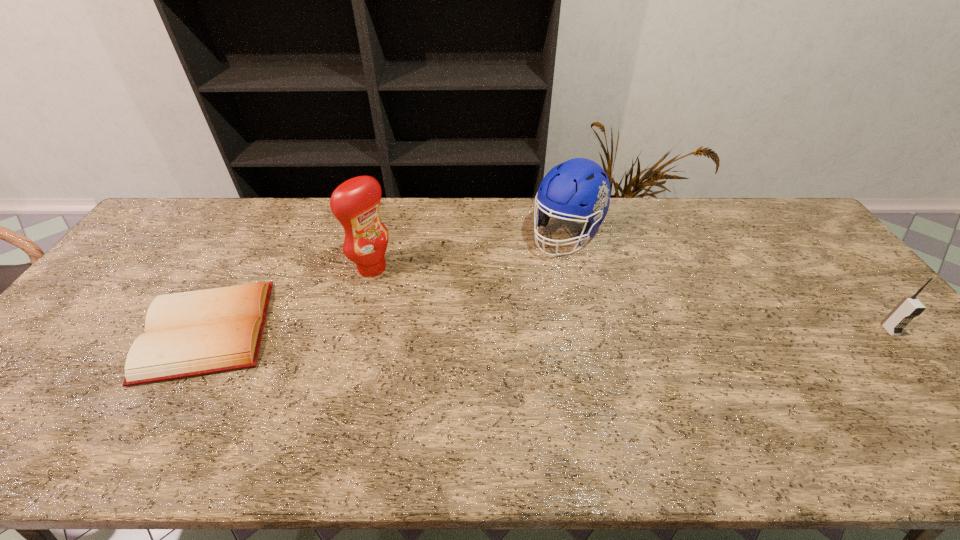
You are a GUI agent. You are given a task and a screenshot of the screen. Output one action in this format:
    pyautogui.click(x=<x>, y=<y>)
    Task: Click on the vacant spot on the desktop that is between the leftmost object and the cellular telephone and is positioned on the face guard of the third object from left to right
    This screenshot has width=960, height=540.
    Given the screenshot: What is the action you would take?
    pyautogui.click(x=471, y=330)

This screenshot has height=540, width=960. I want to click on vacant spot on the desktop that is between the Bible and the third tallest object and is positioned on the label side of the second object from left to right, so click(x=466, y=330).